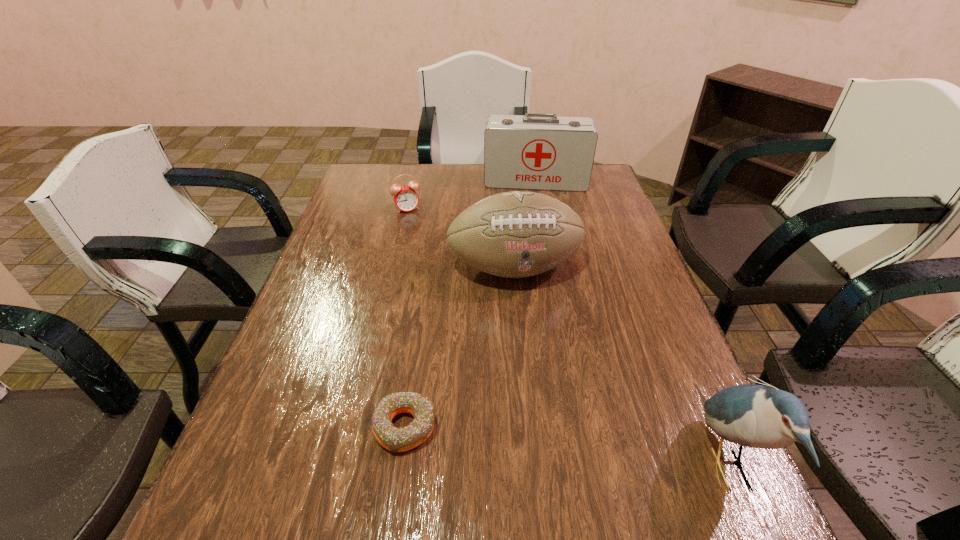
Locate an element on the screen. doughnut is located at coordinates (395, 439).

Where is `the rightmost object`? This screenshot has width=960, height=540. the rightmost object is located at coordinates (759, 416).

The image size is (960, 540). In order to click on the third farthest object in this screenshot , I will do `click(516, 234)`.

Where is `the second shortest object`? the second shortest object is located at coordinates tap(406, 198).

Locate an element on the screen. The width and height of the screenshot is (960, 540). alarm clock is located at coordinates (406, 198).

At what (x,y) coordinates should I click in order to perform the action: click on the first-aid kit. Please return your answer as a coordinate pair (x, y). This screenshot has height=540, width=960. Looking at the image, I should click on (533, 151).

Image resolution: width=960 pixels, height=540 pixels. In order to click on free space located on the right of the doughnut in this screenshot , I will do `click(477, 427)`.

This screenshot has height=540, width=960. What are the coordinates of `blank space located on the laces of the football (American)` in the screenshot? It's located at (538, 327).

Locate an element on the screen. The width and height of the screenshot is (960, 540). vacant space located 0.270m on the laces of the football (American) is located at coordinates (557, 382).

Where is `free point located on the laces of the football (American)`? free point located on the laces of the football (American) is located at coordinates (569, 420).